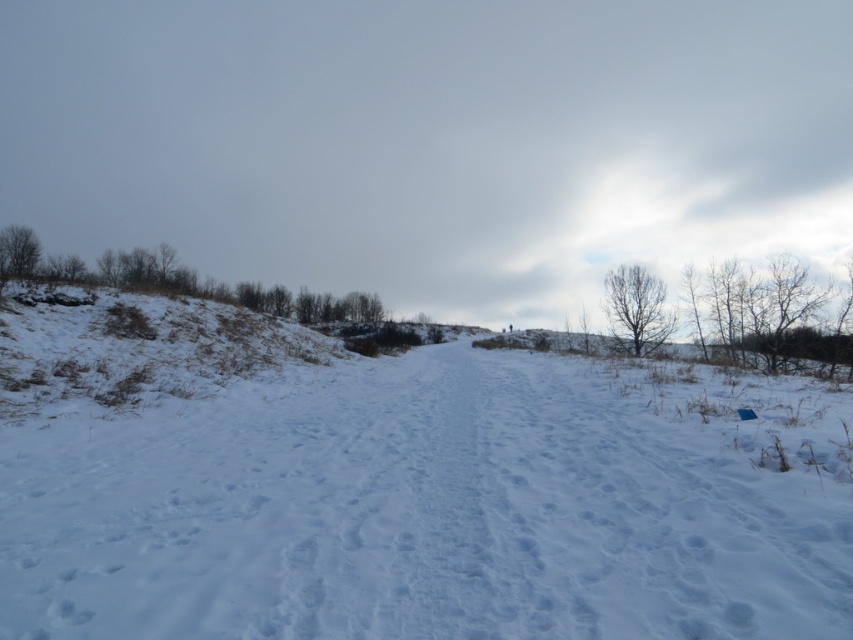
Question: Which point is farther to the camera?

Choices:
 (A) (544, 433)
 (B) (257, 324)

Answer: (B)

Question: Does white fluffy snow at center have a smaller size compared to brown grassy hillside at left?

Choices:
 (A) yes
 (B) no

Answer: (A)

Question: From the image, what is the correct spatial relationship of white fluffy snow at center in relation to brown grassy hillside at left?

Choices:
 (A) left
 (B) right

Answer: (B)

Question: Which point is closer to the camera?

Choices:
 (A) (225, 371)
 (B) (90, 451)

Answer: (B)

Question: Among these objects, which one is farthest from the camera?

Choices:
 (A) brown grassy hillside at left
 (B) white fluffy snow at center

Answer: (A)

Question: Does white fluffy snow at center have a greater width compared to brown grassy hillside at left?

Choices:
 (A) yes
 (B) no

Answer: (A)